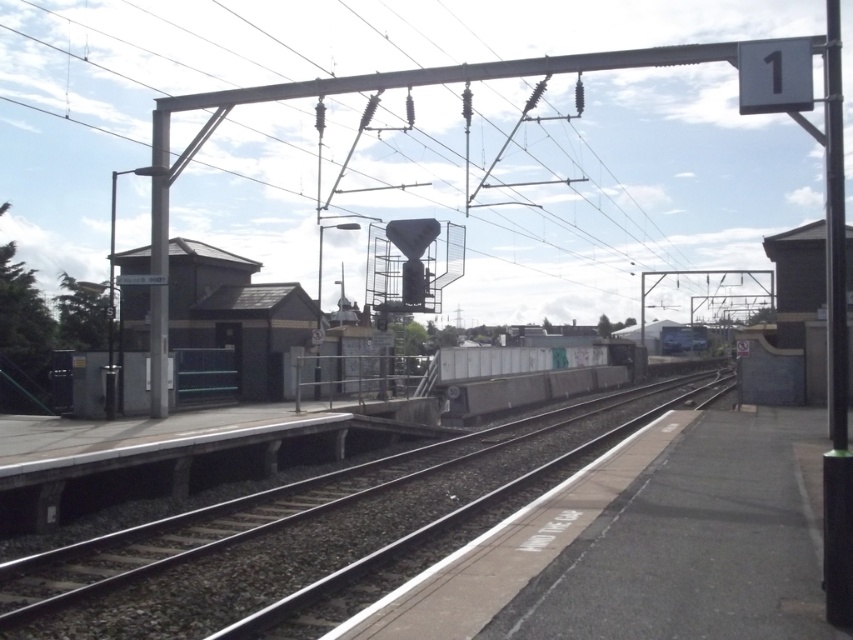
You are standing at the center of the platform and want to walk to the black metal pole at right. Which direction should you move to reach it?

You should move to the right to reach the black metal pole at right since it is located at the right side of the platform.

You are a maintenance worker assigned to check the lengths of the smooth concrete train track at center and the black metal pole at right. According to the scene, which object is longer?

The black metal pole at right is longer than the smooth concrete train track at center.

In the scene shown: You are standing on the platform at the railway station and want to locate the black metal pole at right. According to the coordinates provided, where would you find it?

The black metal pole at right is located at point (x=834, y=349) on the platform.